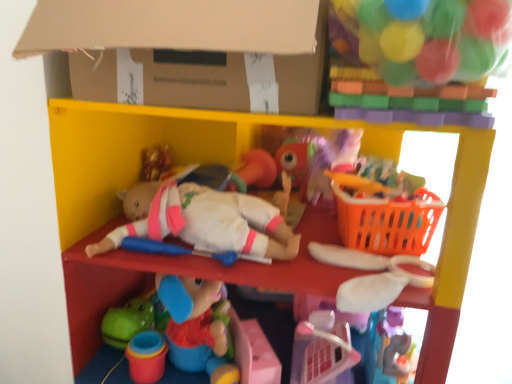
In order to face smooth plastic shelf at center, should I rotate leftwards or rightwards?

Turn right approximately 3.329 degrees to face it.

What is the approximate height of smooth plastic shelf at center?

smooth plastic shelf at center is 1.27 meters tall.

What do you see at coordinates (370, 277) in the screenshot?
I see `white fabric bow at upper right, the 1th toy in the bottom-to-top sequence` at bounding box center [370, 277].

The height and width of the screenshot is (384, 512). Identify the location of smooth plastic shelf at center. (234, 166).

Do you think orange plastic basket at right is within translucent plastic balls at upper right, which is counted as the second toy, starting from the bottom, or outside of it?

orange plastic basket at right exists outside the volume of translucent plastic balls at upper right, which is counted as the second toy, starting from the bottom.

Does orange plastic basket at right have a lesser height compared to translucent plastic balls at upper right, which is counted as the second toy, starting from the bottom?

Incorrect, the height of orange plastic basket at right does not fall short of that of translucent plastic balls at upper right, which is counted as the second toy, starting from the bottom.

This screenshot has width=512, height=384. Identify the location of toy that is the 1st one when counting leftward from the orange plastic basket at right. (422, 37).

Is orange plastic basket at right next to translucent plastic balls at upper right, which is counted as the second toy, starting from the bottom, and touching it?

orange plastic basket at right and translucent plastic balls at upper right, which is counted as the second toy, starting from the bottom, are clearly separated.

Measure the distance between white fabric bow at upper right, acting as the 2th toy starting from the top, and smooth plastic shelf at center.

The distance of white fabric bow at upper right, acting as the 2th toy starting from the top, from smooth plastic shelf at center is 25.53 centimeters.

The width and height of the screenshot is (512, 384). In order to click on shelf on the left of white fabric bow at upper right, acting as the 2th toy starting from the top in this screenshot , I will do `click(234, 166)`.

Between white fabric bow at upper right, the 1th toy in the bottom-to-top sequence, and smooth plastic shelf at center, which one has less height?

Standing shorter between the two is white fabric bow at upper right, the 1th toy in the bottom-to-top sequence.

Is smooth plastic shelf at center located within white fabric bow at upper right, the 1th toy in the bottom-to-top sequence?

No, smooth plastic shelf at center is not a part of white fabric bow at upper right, the 1th toy in the bottom-to-top sequence.

Which is closer, [432,284] or [386,25]?

Clearly, point [432,284] is more distant from the camera than point [386,25].

Is white fabric bow at upper right, acting as the 2th toy starting from the top, wider than translucent plastic balls at upper right, placed as the 1th toy when sorted from top to bottom?

Correct, the width of white fabric bow at upper right, acting as the 2th toy starting from the top, exceeds that of translucent plastic balls at upper right, placed as the 1th toy when sorted from top to bottom.

Identify the location of toy lying on the right of white fabric bow at upper right, the 1th toy in the bottom-to-top sequence. The width and height of the screenshot is (512, 384). 422,37.

In the image, is white fabric bow at upper right, the 1th toy in the bottom-to-top sequence, on the left side or the right side of translucent plastic balls at upper right, placed as the 1th toy when sorted from top to bottom?

In the image, white fabric bow at upper right, the 1th toy in the bottom-to-top sequence, appears on the left side of translucent plastic balls at upper right, placed as the 1th toy when sorted from top to bottom.

Does smooth plastic shelf at center have a lesser height compared to cardboard at upper center?

Incorrect, the height of smooth plastic shelf at center does not fall short of that of cardboard at upper center.

Who is smaller, smooth plastic shelf at center or cardboard at upper center?

With smaller size is cardboard at upper center.

Is smooth plastic shelf at center situated inside cardboard at upper center or outside?

smooth plastic shelf at center is not inside cardboard at upper center, it's outside.

Which point is more forward, (304, 258) or (300, 10)?

Positioned in front is point (300, 10).

Is point (195, 105) closer or farther from the camera than point (66, 199)?

Clearly, point (195, 105) is closer to the camera than point (66, 199).

From a real-world perspective, who is located lower, cardboard at upper center or smooth plastic shelf at center?

smooth plastic shelf at center.

From the image's perspective, relative to smooth plastic shelf at center, is cardboard at upper center above or below?

Clearly, from the image's perspective, cardboard at upper center is above smooth plastic shelf at center.

Is cardboard at upper center aimed at smooth plastic shelf at center?

No, cardboard at upper center is not aimed at smooth plastic shelf at center.

Looking at this image, from the image's perspective, which one is positioned lower, translucent plastic balls at upper right, placed as the 1th toy when sorted from top to bottom, or cardboard at upper center?

translucent plastic balls at upper right, placed as the 1th toy when sorted from top to bottom, from the image's perspective.

Would you say translucent plastic balls at upper right, placed as the 1th toy when sorted from top to bottom, contains cardboard at upper center?

No, cardboard at upper center is located outside of translucent plastic balls at upper right, placed as the 1th toy when sorted from top to bottom.

Can you confirm if translucent plastic balls at upper right, which is counted as the second toy, starting from the bottom, is positioned to the right of cardboard at upper center?

Correct, you'll find translucent plastic balls at upper right, which is counted as the second toy, starting from the bottom, to the right of cardboard at upper center.

Is translucent plastic balls at upper right, placed as the 1th toy when sorted from top to bottom, facing towards cardboard at upper center?

No.

Is orange plastic basket at right at the left side of smooth plastic shelf at center?

In fact, orange plastic basket at right is to the right of smooth plastic shelf at center.

From the picture: From the image's perspective, between orange plastic basket at right and smooth plastic shelf at center, which one is located above?

orange plastic basket at right is shown above in the image.

Can you confirm if orange plastic basket at right is bigger than smooth plastic shelf at center?

Incorrect, orange plastic basket at right is not larger than smooth plastic shelf at center.

Is orange plastic basket at right not close to smooth plastic shelf at center?

orange plastic basket at right is near smooth plastic shelf at center, not far away.

Where is `toy above the orange plastic basket at right (from a real-world perspective)`? toy above the orange plastic basket at right (from a real-world perspective) is located at coordinates (422, 37).

Identify the location of the 1st toy above the smooth plastic shelf at center (from the image's perspective). The width and height of the screenshot is (512, 384). (370, 277).

Which object lies further to the anchor point white fabric bow at upper right, acting as the 2th toy starting from the top, cardboard at upper center or orange plastic basket at right?

Based on the image, cardboard at upper center appears to be further to white fabric bow at upper right, acting as the 2th toy starting from the top.

Considering their positions, is smooth plastic shelf at center positioned closer to white fabric bow at upper right, acting as the 2th toy starting from the top, than cardboard at upper center?

smooth plastic shelf at center.

When comparing their distances from cardboard at upper center, does white fabric bow at upper right, acting as the 2th toy starting from the top, or orange plastic basket at right seem further?

white fabric bow at upper right, acting as the 2th toy starting from the top.

Based on their spatial positions, is cardboard at upper center or orange plastic basket at right further from smooth plastic shelf at center?

The object further to smooth plastic shelf at center is orange plastic basket at right.

Based on their spatial positions, is orange plastic basket at right or white fabric bow at upper right, acting as the 2th toy starting from the top, further from smooth plastic shelf at center?

Based on the image, orange plastic basket at right appears to be further to smooth plastic shelf at center.

Based on their spatial positions, is translucent plastic balls at upper right, placed as the 1th toy when sorted from top to bottom, or orange plastic basket at right closer to smooth plastic shelf at center?

orange plastic basket at right is positioned closer to the anchor smooth plastic shelf at center.

When comparing their distances from white fabric bow at upper right, the 1th toy in the bottom-to-top sequence, does translucent plastic balls at upper right, placed as the 1th toy when sorted from top to bottom, or orange plastic basket at right seem closer?

Based on the image, orange plastic basket at right appears to be nearer to white fabric bow at upper right, the 1th toy in the bottom-to-top sequence.

Looking at this image, estimate the real-world distances between objects in this image. Which object is closer to orange plastic basket at right, smooth plastic shelf at center or white fabric bow at upper right, the 1th toy in the bottom-to-top sequence?

white fabric bow at upper right, the 1th toy in the bottom-to-top sequence.

Locate an element on the screen. basket between cardboard at upper center and smooth plastic shelf at center vertically is located at coordinates (387, 223).

Locate an element on the screen. toy between translucent plastic balls at upper right, placed as the 1th toy when sorted from top to bottom, and smooth plastic shelf at center, in the vertical direction is located at coordinates (370, 277).

Find the location of a particular element. The height and width of the screenshot is (384, 512). toy between cardboard at upper center and white fabric bow at upper right, the 1th toy in the bottom-to-top sequence, in the vertical direction is located at coordinates (422, 37).

Where is `basket between translucent plastic balls at upper right, which is counted as the second toy, starting from the bottom, and smooth plastic shelf at center, in the vertical direction`? basket between translucent plastic balls at upper right, which is counted as the second toy, starting from the bottom, and smooth plastic shelf at center, in the vertical direction is located at coordinates (387, 223).